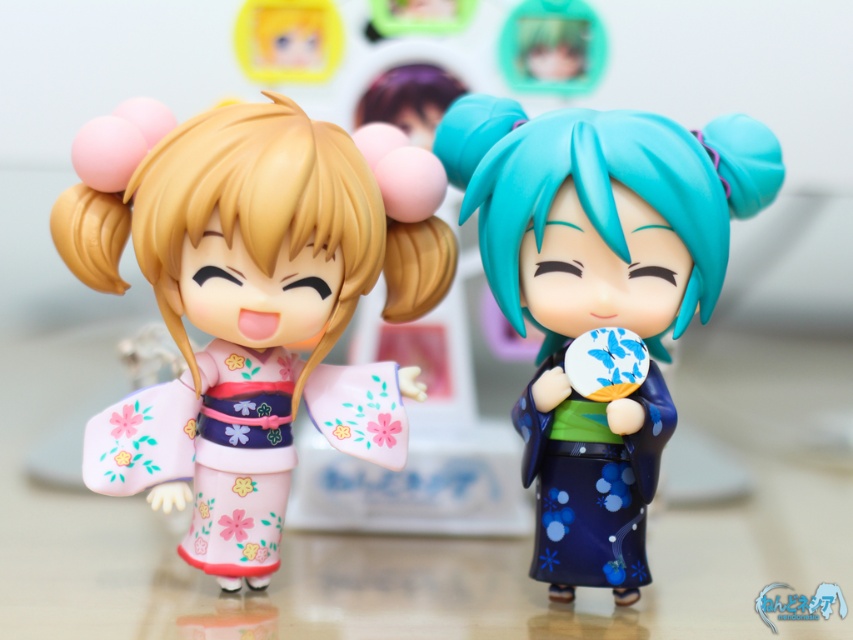
You are an art collector examining two Japanese figurines. The first wears a pink matte kimono at left, and the second has a blue glossy kimono at center. From the perspective of someone standing in front of them, which kimono appears higher?

The pink matte kimono at left appears higher than the blue glossy kimono at center because it is located above it.

You are organizing a display for a cultural festival and need to arrange the pink matte kimono at left and the blue glossy kimono at center. Given that the display shelf has limited space, which kimono should be placed first to ensure both fit without overlapping?

The blue glossy kimono at center should be placed first since its width is smaller than the pink matte kimono at left, allowing both to fit on the shelf without overlapping.